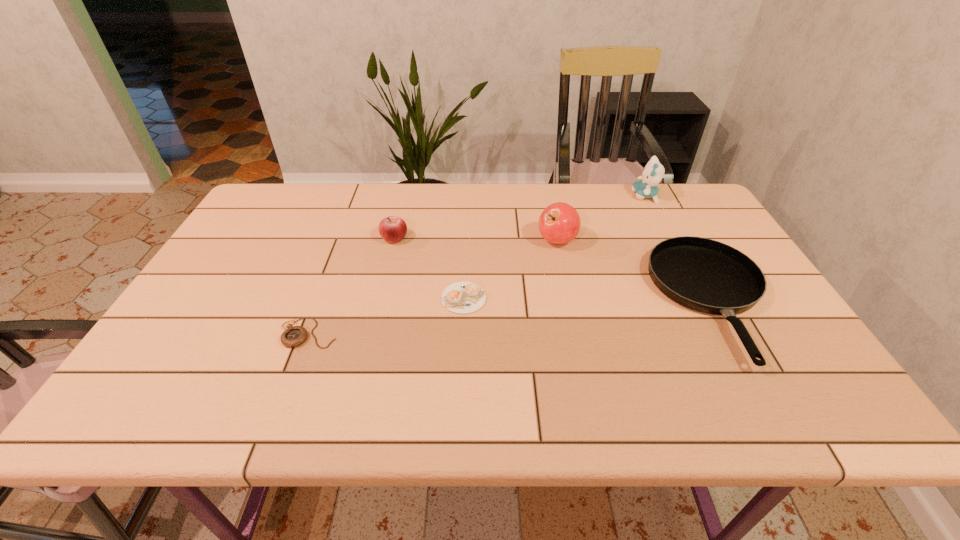
Find the location of a particular element. The height and width of the screenshot is (540, 960). free space between the kitten and the right apple is located at coordinates (601, 218).

Find the location of a particular element. unoccupied area between the shortest object and the shorter apple is located at coordinates (351, 285).

This screenshot has height=540, width=960. Find the location of `vacant space in between the right apple and the farthest object`. vacant space in between the right apple and the farthest object is located at coordinates (601, 218).

Find the location of `free space between the second object from left to right and the farthest object`. free space between the second object from left to right and the farthest object is located at coordinates (519, 217).

Identify the location of vacant space that's between the farthest object and the fourth shortest object. The width and height of the screenshot is (960, 540). (519, 217).

Locate an element on the screen. The width and height of the screenshot is (960, 540). free space that is in between the second shortest object and the frying pan is located at coordinates (588, 300).

The height and width of the screenshot is (540, 960). What are the coordinates of `object that is the fourth closest to the kitten` in the screenshot? It's located at (392, 229).

Choose which object is the nearest neighbor to the third tallest object. Please provide its 2D coordinates. Your answer should be formatted as a tuple, i.e. [(x, y)], where the tuple contains the x and y coordinates of a point satisfying the conditions above.

[(462, 297)]